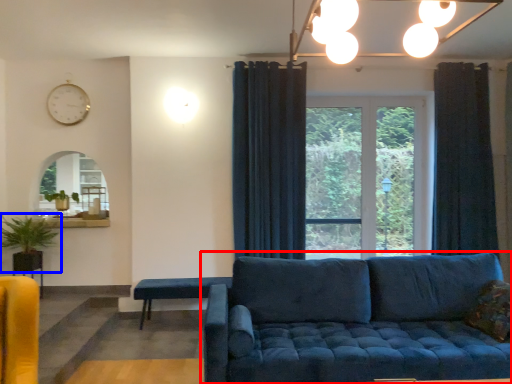
Question: Which object appears farthest to the camera in this image, studio couch (highlighted by a red box) or houseplant (highlighted by a blue box)?

Choices:
 (A) studio couch
 (B) houseplant

Answer: (B)